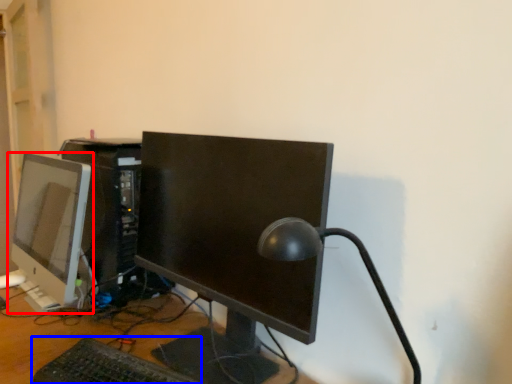
Question: Among these objects, which one is farthest to the camera, computer monitor (highlighted by a red box) or computer keyboard (highlighted by a blue box)?

Choices:
 (A) computer monitor
 (B) computer keyboard

Answer: (A)